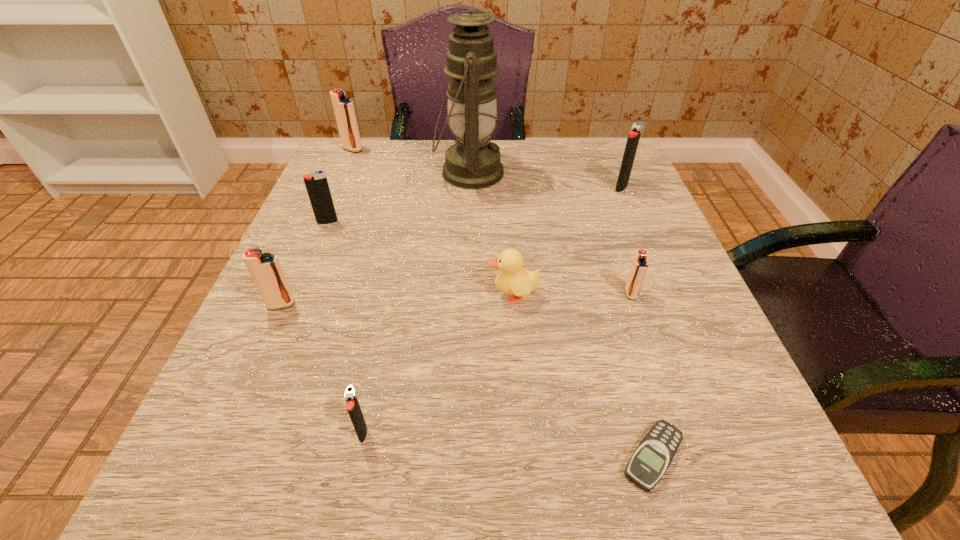
I want to click on igniter that is the closest to the tallest object, so click(x=343, y=107).

This screenshot has height=540, width=960. What are the coordinates of `igniter that is the second closest one to the sixth nearest object` in the screenshot? It's located at (343, 107).

Find the location of `the third closest red igniter to the oil lamp`. the third closest red igniter to the oil lamp is located at coordinates click(265, 269).

Identify which red igniter is the second nearest to the farthest red igniter. Please provide its 2D coordinates. Your answer should be formatted as a tuple, i.e. [(x, y)], where the tuple contains the x and y coordinates of a point satisfying the conditions above.

[(639, 266)]

Where is `black igniter that is the second nearest to the oil lamp`? This screenshot has height=540, width=960. black igniter that is the second nearest to the oil lamp is located at coordinates (634, 135).

Where is `black igniter that stands as the second closest to the gray beeper`? black igniter that stands as the second closest to the gray beeper is located at coordinates (634, 135).

Find the location of `vacant area that satisfies the following two spatial constraints: 1. on the front side of the second smallest black igniter; 2. on the right side of the rightmost red igniter`. vacant area that satisfies the following two spatial constraints: 1. on the front side of the second smallest black igniter; 2. on the right side of the rightmost red igniter is located at coordinates (299, 294).